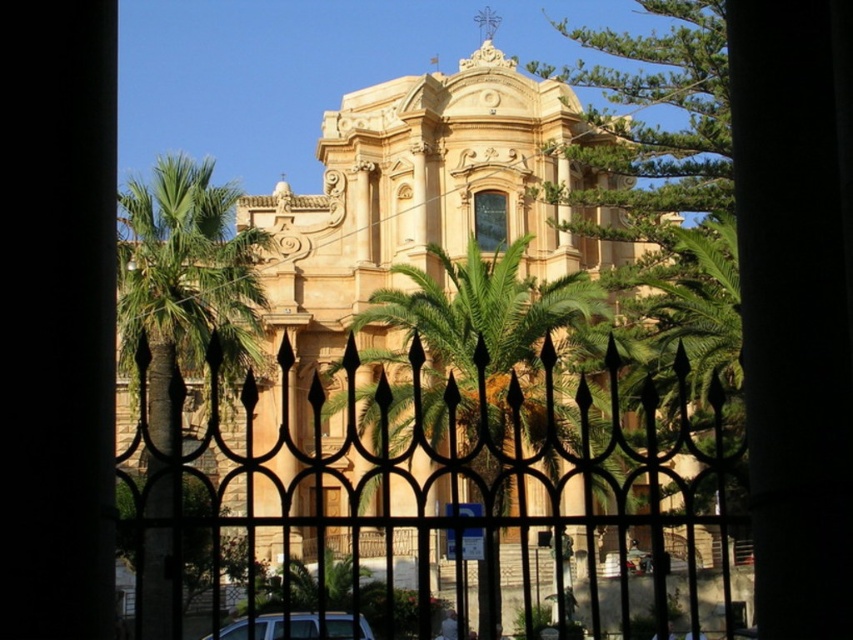
You are a drone operator tasked with capturing aerial footage of the grand building. The drone is currently positioned at point A, which is at the center of the image. You need to adjust the drone to focus on the green leafy tree at upper right. In which direction should you move the drone to reach the tree?

The green leafy tree at upper right is located at point (654,124), which is to the upper right of the center point. Move the drone towards the upper right direction to reach the tree.

You are standing in front of the grand building and see two points marked on the ground. The first point is at coordinate point (x=144, y=554) and the second point is at coordinate point (x=692, y=177). Which point is closer to the palm trees?

Point (x=144, y=554) is in front of point (x=692, y=177), so it is closer to the palm trees.

You are a photographer planning to capture the grand building in the background. You have a camera with a 50mm lens that has a field of view suitable for capturing objects up to 3 meters wide. The green leafy palm tree at center and the silver metallic car at lower center are in the foreground. Will the palm tree block the view of the building if you position yourself so that both objects are in frame?

The green leafy palm tree at center is bigger than the silver metallic car at lower center. Since the palm tree is larger, it may block part of the building if positioned in the foreground. Ensure the tree is placed to the side or adjust your angle to include both without obstruction.